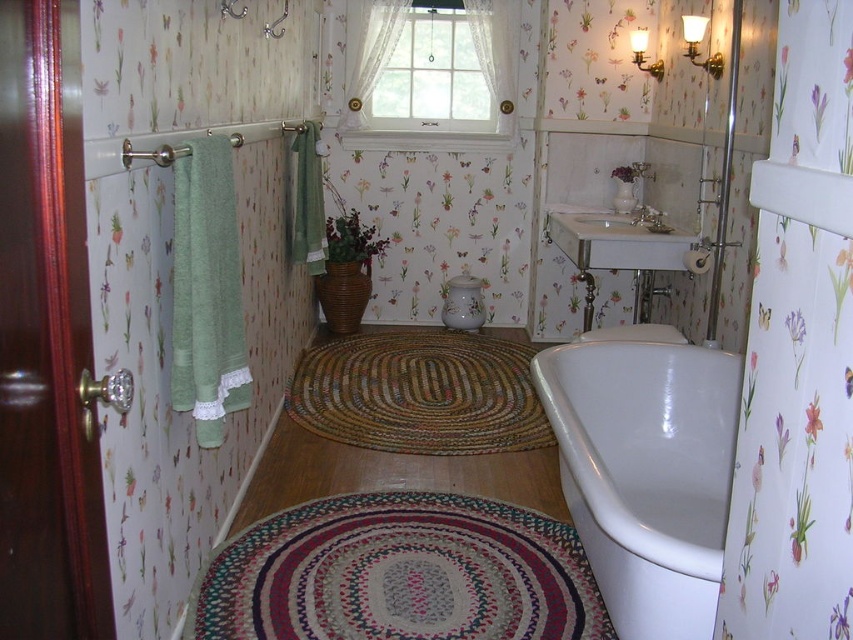
Consider the image. You are standing in the bathroom and want to place a decorative plant on the floor. You have two spots in mind, one at point [647,356] and another at point [582,266]. Which point is closer to you?

Point [647,356] is closer to the viewer than point [582,266], so you should place the plant there if you want it nearer to your position.

You are designing a layout for a new bathroom and want to place a large potted plant between the white glossy bathtub at lower right and the white porcelain sink at center. Considering their sizes, which object should the plant be closer to?

The white glossy bathtub at lower right is bigger than the white porcelain sink at center, so the plant should be placed closer to the white glossy bathtub at lower right to maintain balance in the layout.

You are planning to move a large potted plant into this bathroom. The plant requires a space that is wider than the white porcelain sink at center. Based on the scene, can the white glossy bathtub at lower right provide enough width for the plant?

The white glossy bathtub at lower right has a larger width than the white porcelain sink at center, so it can accommodate the plant needing more space.